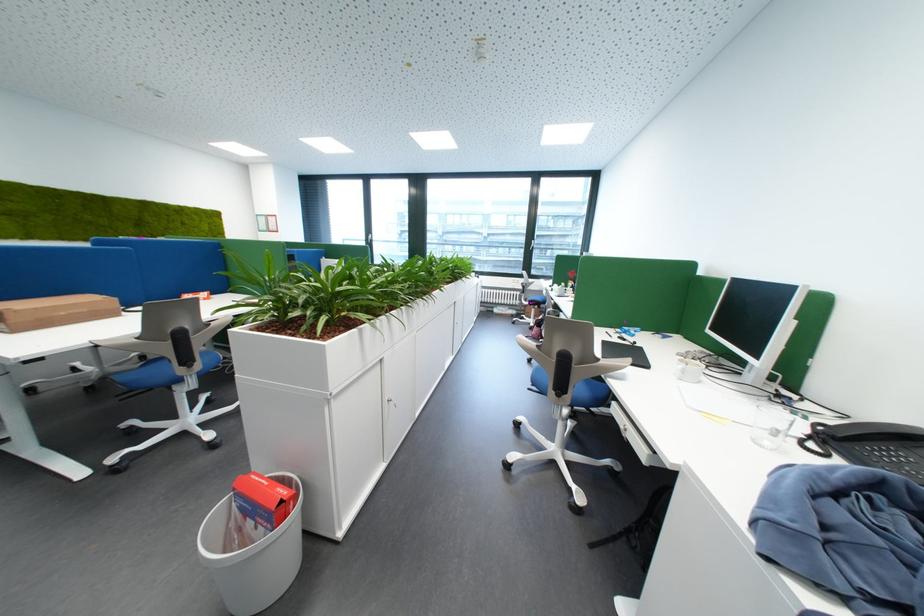
What do you see at coordinates (55, 310) in the screenshot? I see `the brown cardboard box` at bounding box center [55, 310].